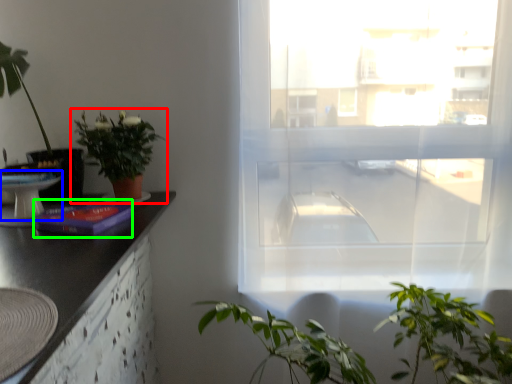
Question: Which object is the closest to the houseplant (highlighted by a red box)? Choose among these: round table (highlighted by a blue box) or book (highlighted by a green box).

Choices:
 (A) round table
 (B) book

Answer: (B)